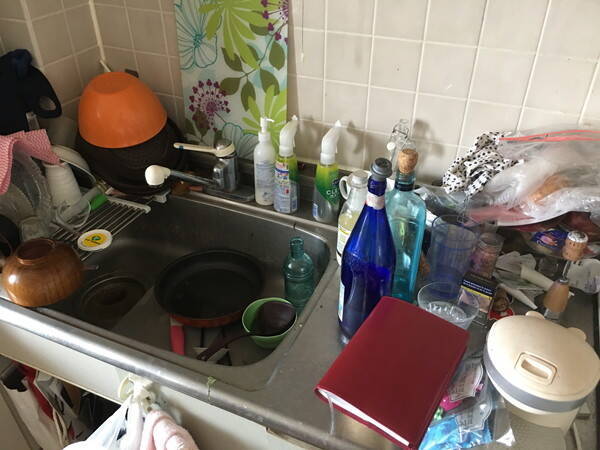
This screenshot has width=600, height=450. Identify the location of tiled wall. (331, 57).